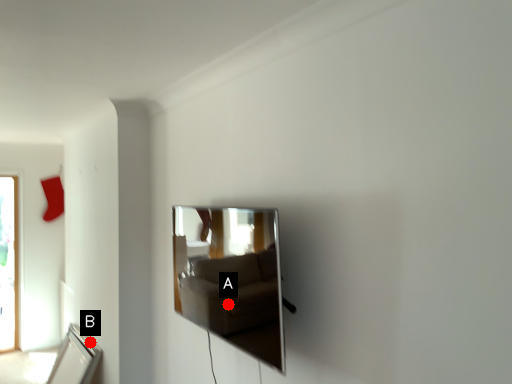
Question: Two points are circled on the image, labeled by A and B beside each circle. Among these points, which one is nearest to the camera?

Choices:
 (A) A is closer
 (B) B is closer

Answer: (A)